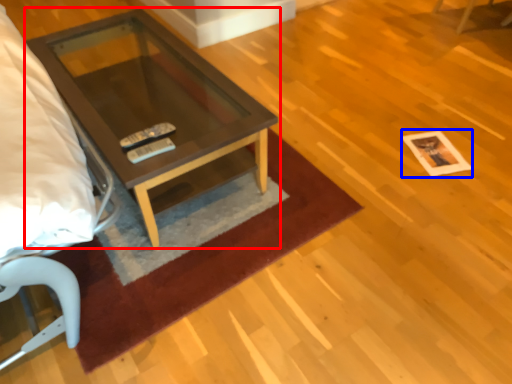
Question: Among these objects, which one is nearest to the camera, coffee table (highlighted by a red box) or square (highlighted by a blue box)?

Choices:
 (A) coffee table
 (B) square

Answer: (A)